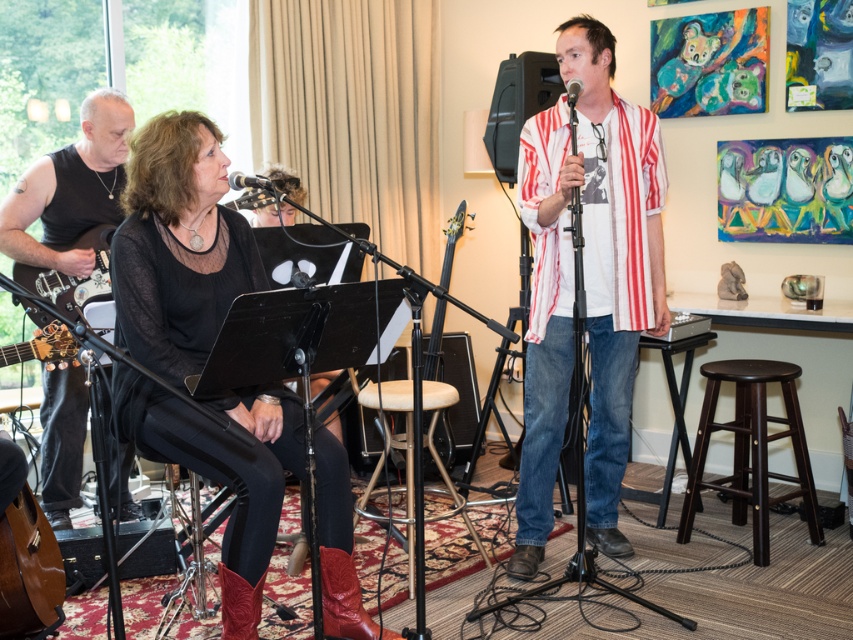
Question: Which point appears closest to the camera in this image?

Choices:
 (A) (229, 252)
 (B) (756, 381)
 (C) (16, 282)

Answer: (A)

Question: Can you confirm if black leather guitar at left is wider than leather cowboy boot at lower left?

Choices:
 (A) no
 (B) yes

Answer: (B)

Question: Which point is farther from the camera taking this photo?

Choices:
 (A) (248, 586)
 (B) (740, 385)
 (C) (45, 196)

Answer: (B)

Question: Where is matte black dress at center located in relation to wooden acoustic guitar at left in the image?

Choices:
 (A) below
 (B) above

Answer: (A)

Question: Which of the following is the farthest from the observer?

Choices:
 (A) wooden acoustic guitar at left
 (B) matte black dress at center
 (C) black leather guitar at left
 (D) leather cowboy boot at lower left

Answer: (C)

Question: Does black leather guitar at left come in front of dark wood stool at lower right?

Choices:
 (A) no
 (B) yes

Answer: (B)